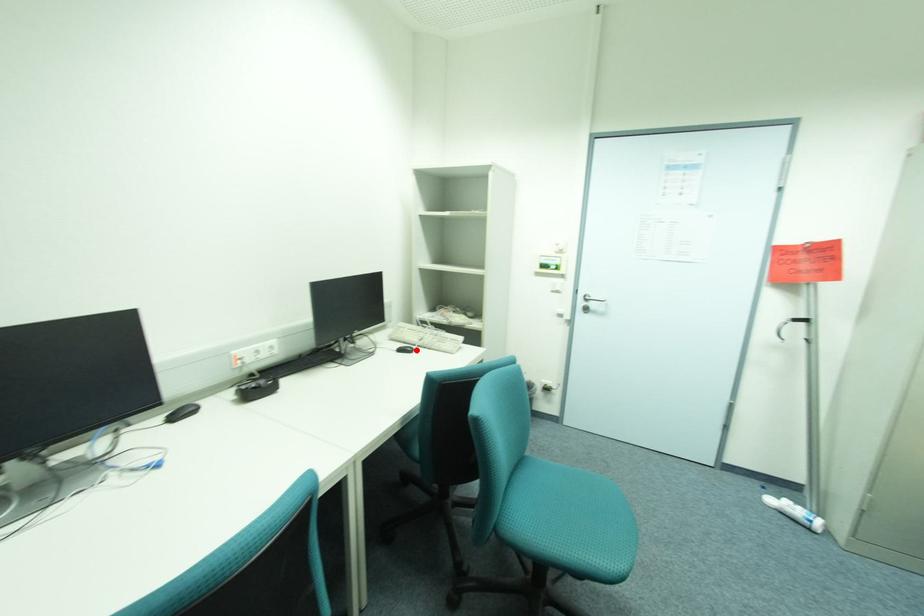
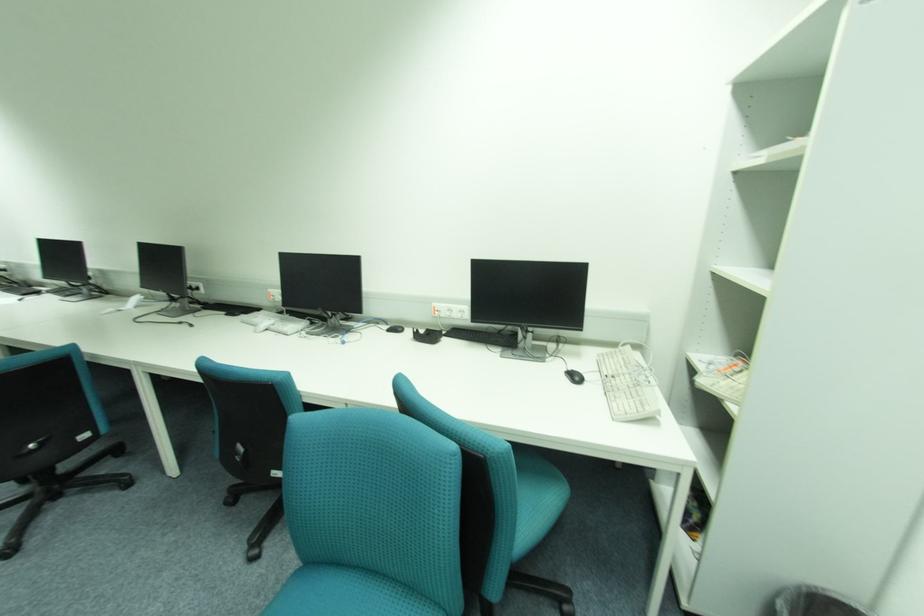
Find the pixel in the second image that matches the highlighted location in the first image.

(584, 379)